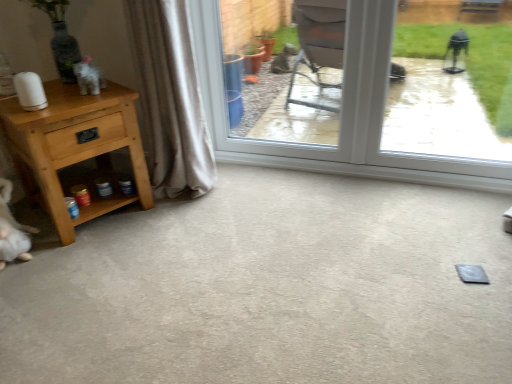
What are the coordinates of `vacant space situated above gray carpet at lower left (from a real-world perspective)` in the screenshot? It's located at (252, 256).